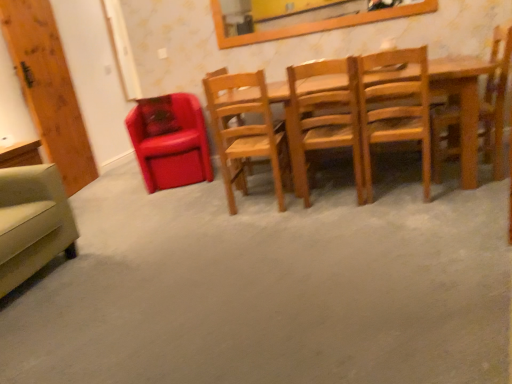
Question: Which direction should I rotate to look at wooden chair at center, arranged as the third chair when viewed from the left, — up or down?

Choices:
 (A) up
 (B) down

Answer: (A)

Question: Is matte leather chair at left, the 5th chair viewed from the right, positioned beyond the bounds of beige fabric armchair at lower left, the 1th chair positioned from the left?

Choices:
 (A) yes
 (B) no

Answer: (A)

Question: Can you confirm if matte leather chair at left, marked as the second chair in a left-to-right arrangement, is shorter than beige fabric armchair at lower left, the 1th chair positioned from the left?

Choices:
 (A) no
 (B) yes

Answer: (A)

Question: From the image's perspective, does matte leather chair at left, the 5th chair viewed from the right, appear lower than beige fabric armchair at lower left, the 1th chair positioned from the left?

Choices:
 (A) yes
 (B) no

Answer: (B)

Question: Is matte leather chair at left, the 5th chair viewed from the right, wider than beige fabric armchair at lower left, placed as the 6th chair when sorted from right to left?

Choices:
 (A) no
 (B) yes

Answer: (A)

Question: From the image's perspective, is matte leather chair at left, the 5th chair viewed from the right, located above beige fabric armchair at lower left, the 1th chair positioned from the left?

Choices:
 (A) no
 (B) yes

Answer: (B)

Question: Can you confirm if matte leather chair at left, marked as the second chair in a left-to-right arrangement, is positioned to the right of beige fabric armchair at lower left, the 1th chair positioned from the left?

Choices:
 (A) no
 (B) yes

Answer: (B)

Question: Can you confirm if wooden chair at center, marked as the 2th chair in a right-to-left arrangement, is shorter than wooden chair at right, the sixth chair positioned from the left?

Choices:
 (A) no
 (B) yes

Answer: (B)

Question: Is the position of wooden chair at center, marked as the 2th chair in a right-to-left arrangement, more distant than that of wooden chair at right, which is the 1th chair in right-to-left order?

Choices:
 (A) yes
 (B) no

Answer: (B)

Question: Considering the relative sizes of wooden chair at center, the fifth chair viewed from the left, and wooden chair at right, the sixth chair positioned from the left, in the image provided, is wooden chair at center, the fifth chair viewed from the left, bigger than wooden chair at right, the sixth chair positioned from the left,?

Choices:
 (A) yes
 (B) no

Answer: (B)

Question: From the image's perspective, would you say wooden chair at center, marked as the 2th chair in a right-to-left arrangement, is positioned over wooden chair at right, the sixth chair positioned from the left?

Choices:
 (A) no
 (B) yes

Answer: (A)

Question: Is wooden chair at center, marked as the 2th chair in a right-to-left arrangement, in contact with wooden chair at right, which is the 1th chair in right-to-left order?

Choices:
 (A) no
 (B) yes

Answer: (A)

Question: Can you confirm if wooden chair at center, marked as the 2th chair in a right-to-left arrangement, is positioned to the left of wooden chair at right, the sixth chair positioned from the left?

Choices:
 (A) yes
 (B) no

Answer: (A)

Question: Would you say beige fabric armchair at lower left, placed as the 6th chair when sorted from right to left, is outside wooden chair at right, which is the 1th chair in right-to-left order?

Choices:
 (A) no
 (B) yes

Answer: (B)